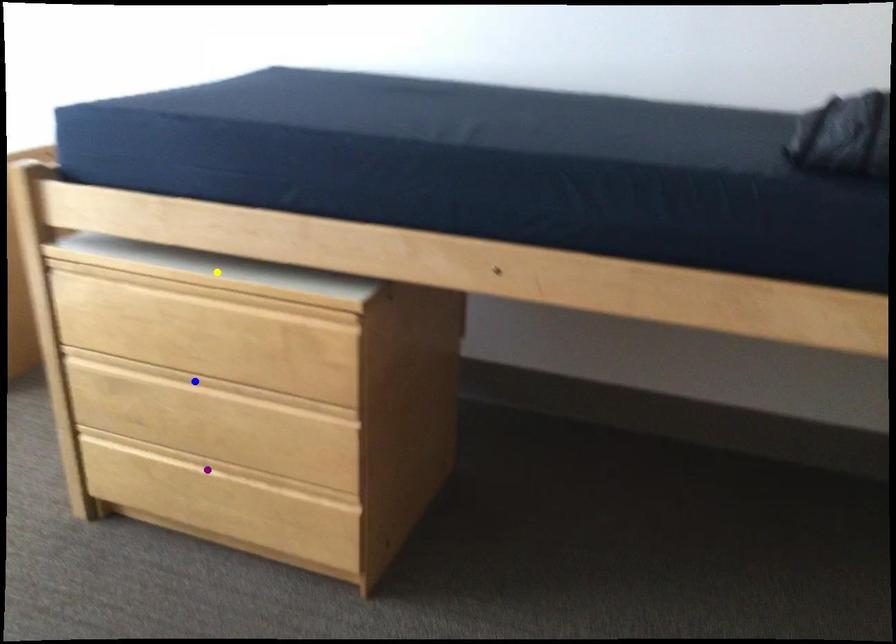
Order these from nearest to farthest:
blue point | purple point | yellow point

yellow point
blue point
purple point